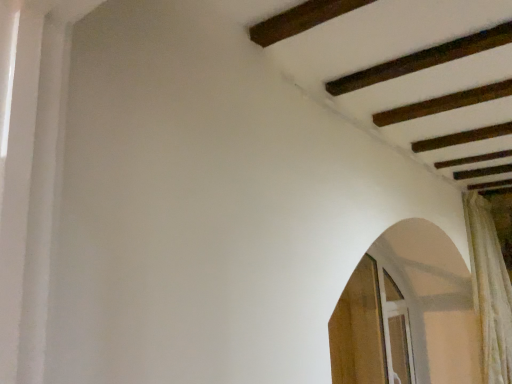
Question: Could white textured curtain at right be considered to be inside wooden screen door at lower right, the second screen door viewed from the right?

Choices:
 (A) yes
 (B) no

Answer: (B)

Question: Is wooden screen door at lower right, the second screen door viewed from the right, wider than white textured curtain at right?

Choices:
 (A) yes
 (B) no

Answer: (B)

Question: From the image's perspective, would you say wooden screen door at lower right, the second screen door viewed from the right, is positioned over white textured curtain at right?

Choices:
 (A) no
 (B) yes

Answer: (A)

Question: Considering the relative positions of wooden screen door at lower right, the second screen door viewed from the right, and white textured curtain at right in the image provided, is wooden screen door at lower right, the second screen door viewed from the right, to the left of white textured curtain at right from the viewer's perspective?

Choices:
 (A) no
 (B) yes

Answer: (B)

Question: From a real-world perspective, is wooden screen door at lower right, the second screen door viewed from the right, below white textured curtain at right?

Choices:
 (A) yes
 (B) no

Answer: (A)

Question: Visually, is clear glass screen door at lower right, which ranks as the 2th screen door in left-to-right order, positioned to the left or to the right of white textured curtain at right?

Choices:
 (A) right
 (B) left

Answer: (B)

Question: Does point (407, 375) appear closer or farther from the camera than point (494, 311)?

Choices:
 (A) farther
 (B) closer

Answer: (A)

Question: From a real-world perspective, is clear glass screen door at lower right, which is counted as the first screen door, starting from the right, physically located above or below white textured curtain at right?

Choices:
 (A) below
 (B) above

Answer: (A)

Question: Is clear glass screen door at lower right, which ranks as the 2th screen door in left-to-right order, wider or thinner than white textured curtain at right?

Choices:
 (A) thin
 (B) wide

Answer: (A)

Question: Considering their positions, is white textured curtain at right located in front of or behind wooden screen door at lower right, the second screen door viewed from the right?

Choices:
 (A) front
 (B) behind

Answer: (B)

Question: From a real-world perspective, is white textured curtain at right above or below wooden screen door at lower right, the second screen door viewed from the right?

Choices:
 (A) above
 (B) below

Answer: (A)

Question: Is point (492, 238) closer or farther from the camera than point (385, 372)?

Choices:
 (A) farther
 (B) closer

Answer: (B)

Question: Would you say white textured curtain at right is to the left or to the right of wooden screen door at lower right, the second screen door viewed from the right, in the picture?

Choices:
 (A) right
 (B) left

Answer: (A)

Question: Based on their positions, is wooden screen door at lower right, the second screen door viewed from the right, located to the left or right of white textured curtain at right?

Choices:
 (A) right
 (B) left

Answer: (B)

Question: Is wooden screen door at lower right, positioned as the first screen door in left-to-right order, inside the boundaries of white textured curtain at right, or outside?

Choices:
 (A) outside
 (B) inside

Answer: (A)